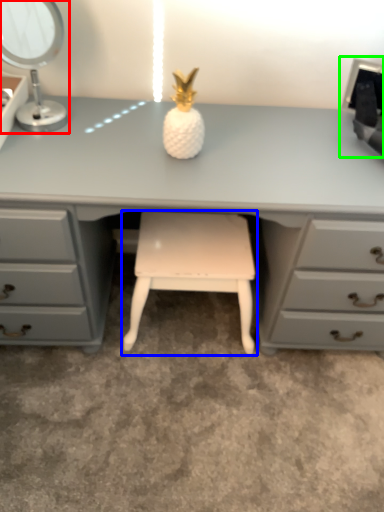
Question: Estimate the real-world distances between objects in this image. Which object is farther from table lamp (highlighted by a red box), stool (highlighted by a blue box) or desktop computer (highlighted by a green box)?

Choices:
 (A) stool
 (B) desktop computer

Answer: (B)